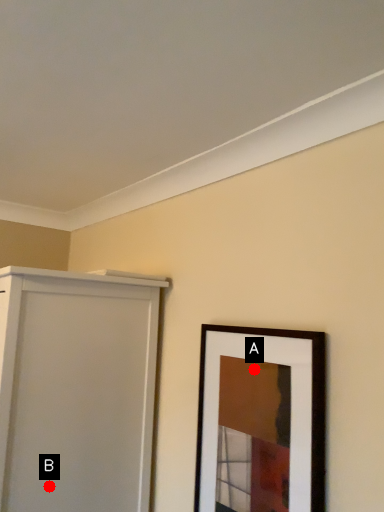
Question: Two points are circled on the image, labeled by A and B beside each circle. Which point is closer to the camera?

Choices:
 (A) A is closer
 (B) B is closer

Answer: (A)